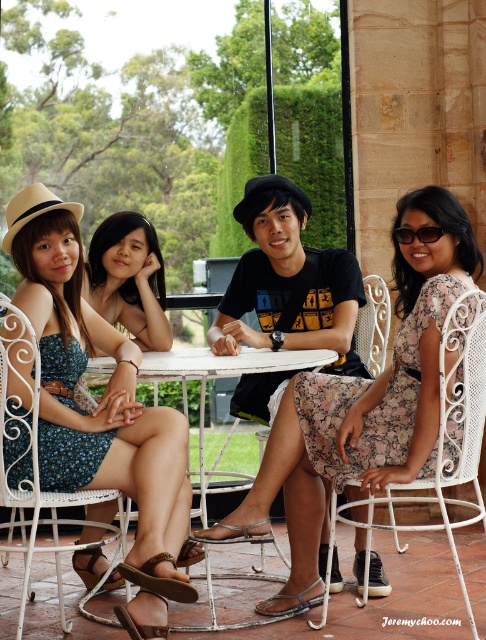
Question: Where is white wrought iron chair at lower right located in relation to white wrought iron chair at lower left in the image?

Choices:
 (A) above
 (B) below

Answer: (B)

Question: Which point is closer to the camera?

Choices:
 (A) pyautogui.click(x=353, y=502)
 (B) pyautogui.click(x=183, y=369)

Answer: (A)

Question: Estimate the real-world distances between objects in this image. Which object is closer to the blue floral dress at center?

Choices:
 (A) white metal table at center
 (B) white wrought iron chair at lower left
 (C) black plastic sunglasses at upper right

Answer: (B)

Question: Which point is farther from the camera taking this photo?

Choices:
 (A) (105, 230)
 (B) (23, 577)
 (C) (240, 209)

Answer: (A)

Question: Can you confirm if blue floral dress at center is smaller than black plastic sunglasses at upper right?

Choices:
 (A) yes
 (B) no

Answer: (B)

Question: Does black cotton t-shirt at center have a larger size compared to white metal table at center?

Choices:
 (A) no
 (B) yes

Answer: (A)